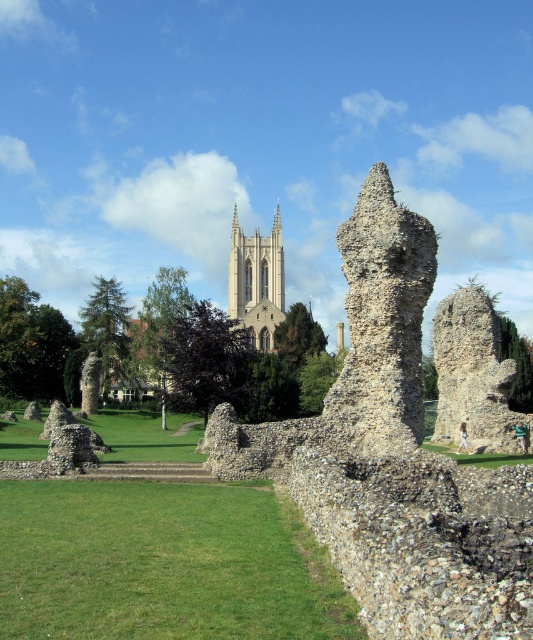
Measure the distance between point (438, 420) and camera.

Point (438, 420) is 54.45 meters from camera.

Is point (480, 392) positioned behind point (279, 288)?

No, it is in front of (279, 288).

Which is in front, point (474, 436) or point (263, 285)?

Point (474, 436) is in front.

Find the location of `rustic stone tower at center`. rustic stone tower at center is located at coordinates (472, 372).

Who is shorter, rustic stone sculpture at center or white stone tower at center?

rustic stone sculpture at center is shorter.

Does point (417, 230) come closer to viewer compared to point (273, 243)?

Yes, point (417, 230) is closer to viewer.

This screenshot has height=640, width=533. I want to click on rustic stone sculpture at center, so click(382, 323).

Does rustic stone ruins at center have a lesser height compared to rustic stone sculpture at center?

Incorrect, rustic stone ruins at center's height does not fall short of rustic stone sculpture at center's.

Is point (335, 468) farther from camera compared to point (409, 433)?

No.

The width and height of the screenshot is (533, 640). I want to click on rustic stone ruins at center, so click(x=393, y=458).